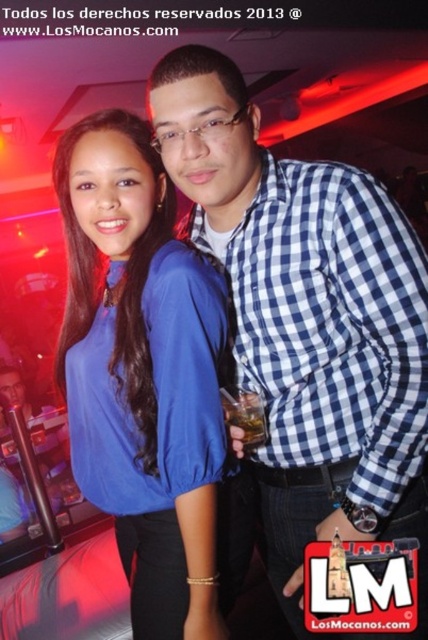
Question: Which point is farther from the camera taking this photo?

Choices:
 (A) (145, 502)
 (B) (250, 104)

Answer: (A)

Question: Which point is farther from the camera taking this photo?

Choices:
 (A) (354, 305)
 (B) (83, 378)

Answer: (B)

Question: Does blue checkered shirt at center have a lesser width compared to matte blue blouse at center?

Choices:
 (A) yes
 (B) no

Answer: (B)

Question: Is blue checkered shirt at center thinner than matte blue blouse at center?

Choices:
 (A) yes
 (B) no

Answer: (B)

Question: Observing the image, what is the correct spatial positioning of blue checkered shirt at center in reference to matte blue blouse at center?

Choices:
 (A) left
 (B) right

Answer: (B)